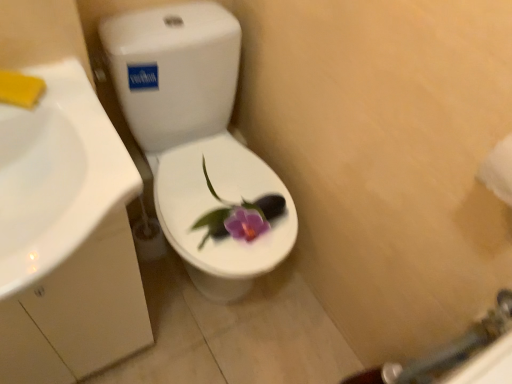
Question: Considering their positions, is white glossy toilet at center located in front of or behind white glossy sink at left?

Choices:
 (A) behind
 (B) front

Answer: (A)

Question: Considering the positions of white glossy toilet at center and white glossy sink at left in the image, is white glossy toilet at center taller or shorter than white glossy sink at left?

Choices:
 (A) short
 (B) tall

Answer: (B)

Question: Which object is the closest to the white glossy toilet at center?

Choices:
 (A) white glossy sink at left
 (B) white paper towel at right

Answer: (A)

Question: Which is farther from the white glossy toilet at center?

Choices:
 (A) white glossy sink at left
 (B) white paper towel at right

Answer: (B)